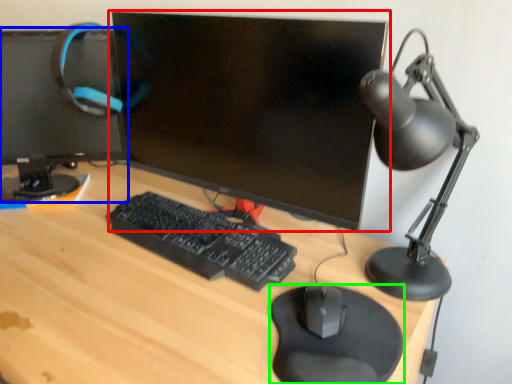
Question: Considering the real-world distances, which object is closest to computer monitor (highlighted by a red box)? computer monitor (highlighted by a blue box) or mousepad (highlighted by a green box).

Choices:
 (A) computer monitor
 (B) mousepad

Answer: (A)